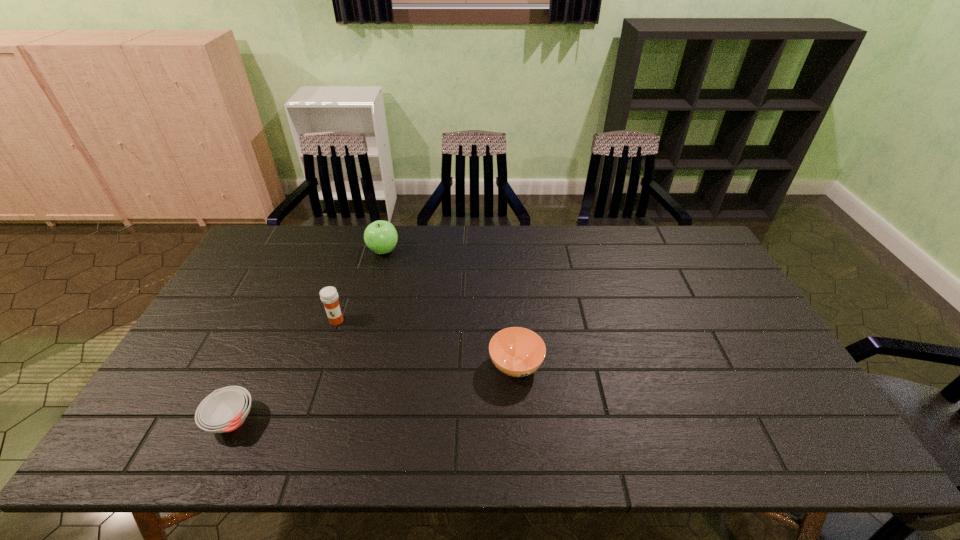
The image size is (960, 540). What are the coordinates of `the third object from left to right` in the screenshot? It's located at (381, 237).

You are a GUI agent. You are given a task and a screenshot of the screen. Output one action in this format:
    pyautogui.click(x=<x>, y=<y>)
    Task: Click on the farthest object
    
    Given the screenshot: What is the action you would take?
    pyautogui.click(x=381, y=237)

Find the location of a particular element. medicine is located at coordinates (329, 296).

The width and height of the screenshot is (960, 540). What are the coordinates of `the second object from left to right` in the screenshot? It's located at (329, 296).

Find the location of a particular element. the right soup bowl is located at coordinates (517, 352).

Identify the location of the taller soup bowl. Image resolution: width=960 pixels, height=540 pixels. (517, 352).

Image resolution: width=960 pixels, height=540 pixels. Identify the location of the nearer soup bowl. (224, 410).

Where is `the shortest object`? This screenshot has height=540, width=960. the shortest object is located at coordinates click(x=224, y=410).

I want to click on vacant space located on the left of the second object from right to left, so click(x=333, y=251).

The image size is (960, 540). I want to click on blank space located on the label side of the medicine, so click(x=325, y=354).